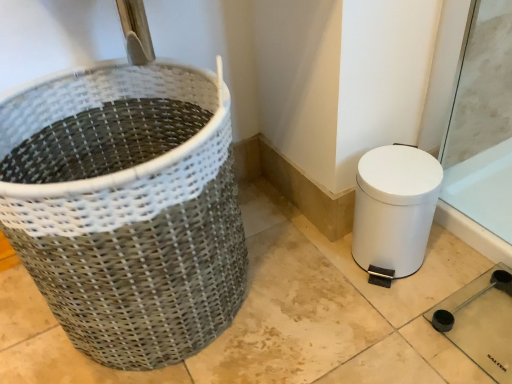
You are a GUI agent. You are given a task and a screenshot of the screen. Output one action in this format:
    pyautogui.click(x=<x>, y=<y>)
    Task: Click on the natural woven basket at left
    The width and height of the screenshot is (512, 384).
    Given the screenshot: What is the action you would take?
    pyautogui.click(x=126, y=208)

The width and height of the screenshot is (512, 384). Describe the element at coordinates (126, 208) in the screenshot. I see `natural woven basket at left` at that location.

Where is `white matte toilet bowl at lower right`? The width and height of the screenshot is (512, 384). white matte toilet bowl at lower right is located at coordinates (394, 207).

What do you see at coordinates (394, 207) in the screenshot?
I see `white matte toilet bowl at lower right` at bounding box center [394, 207].

Measure the distance between point (371, 180) and camera.

They are 34.29 inches apart.

At what (x,y) coordinates should I click in order to perform the action: click on natural woven basket at left. Please return your answer as a coordinate pair (x, y). This screenshot has height=384, width=512. Looking at the image, I should click on (126, 208).

In the image, is natural woven basket at left on the left side or the right side of white matte toilet bowl at lower right?

In the image, natural woven basket at left appears on the left side of white matte toilet bowl at lower right.

In the image, is natural woven basket at left positioned in front of or behind white matte toilet bowl at lower right?

natural woven basket at left is positioned closer to the viewer than white matte toilet bowl at lower right.

Does point (163, 67) lie behind point (438, 192)?

No, it is not.

From the image's perspective, is natural woven basket at left over white matte toilet bowl at lower right?

Indeed, from the image's perspective, natural woven basket at left is shown above white matte toilet bowl at lower right.

From a real-world perspective, which is physically below, natural woven basket at left or white matte toilet bowl at lower right?

From a 3D spatial view, white matte toilet bowl at lower right is below.

Does natural woven basket at left have a greater width compared to white matte toilet bowl at lower right?

Yes.

From the picture: Considering the sizes of natural woven basket at left and white matte toilet bowl at lower right in the image, is natural woven basket at left taller or shorter than white matte toilet bowl at lower right?

Considering their sizes, natural woven basket at left has more height than white matte toilet bowl at lower right.

Is natural woven basket at left bigger than white matte toilet bowl at lower right?

Yes.

Is natural woven basket at left completely or partially outside of white matte toilet bowl at lower right?

Yes, natural woven basket at left is located beyond the bounds of white matte toilet bowl at lower right.

Is natural woven basket at left in contact with white matte toilet bowl at lower right?

No, natural woven basket at left is not in contact with white matte toilet bowl at lower right.

Is natural woven basket at left oriented away from white matte toilet bowl at lower right?

No, natural woven basket at left's orientation is not away from white matte toilet bowl at lower right.

How much distance is there between natural woven basket at left and white matte toilet bowl at lower right?

They are 17.22 inches apart.

Locate an element on the screen. waste container lying in front of the white matte toilet bowl at lower right is located at coordinates (126, 208).

Can you confirm if white matte toilet bowl at lower right is positioned to the right of natural woven basket at left?

Indeed, white matte toilet bowl at lower right is positioned on the right side of natural woven basket at left.

Is the position of white matte toilet bowl at lower right less distant than that of natural woven basket at left?

That is False.

Considering the points (398, 251) and (177, 164), which point is in front, point (398, 251) or point (177, 164)?

The point (177, 164) is in front.

From the image's perspective, is white matte toilet bowl at lower right located above or below natural woven basket at left?

Clearly, from the image's perspective, white matte toilet bowl at lower right is below natural woven basket at left.

From a real-world perspective, which is physically above, white matte toilet bowl at lower right or natural woven basket at left?

natural woven basket at left, from a real-world perspective.

Considering the relative sizes of white matte toilet bowl at lower right and natural woven basket at left in the image provided, is white matte toilet bowl at lower right thinner than natural woven basket at left?

Yes.

Considering the sizes of objects white matte toilet bowl at lower right and natural woven basket at left in the image provided, who is shorter, white matte toilet bowl at lower right or natural woven basket at left?

With less height is white matte toilet bowl at lower right.

Based on their sizes in the image, would you say white matte toilet bowl at lower right is bigger or smaller than natural woven basket at left?

Clearly, white matte toilet bowl at lower right is smaller in size than natural woven basket at left.

Choose the correct answer: Is white matte toilet bowl at lower right inside natural woven basket at left or outside it?

white matte toilet bowl at lower right is located beyond the bounds of natural woven basket at left.

Are white matte toilet bowl at lower right and natural woven basket at left located far from each other?

No, there isn't a large distance between white matte toilet bowl at lower right and natural woven basket at left.

Is white matte toilet bowl at lower right positioned with its back to natural woven basket at left?

white matte toilet bowl at lower right is not turned away from natural woven basket at left.

How many degrees apart are the facing directions of white matte toilet bowl at lower right and natural woven basket at left?

They differ by 0.15 degrees in their facing directions.

Measure the distance between white matte toilet bowl at lower right and natural woven basket at left.

white matte toilet bowl at lower right is 17.22 inches from natural woven basket at left.

At what (x,y) coordinates should I click in order to perform the action: click on waste container above the white matte toilet bowl at lower right (from a real-world perspective). Please return your answer as a coordinate pair (x, y). This screenshot has width=512, height=384. Looking at the image, I should click on (126, 208).

You are a GUI agent. You are given a task and a screenshot of the screen. Output one action in this format:
    pyautogui.click(x=<x>, y=<y>)
    Task: Click on the waste container located in front of the white matte toilet bowl at lower right
    
    Given the screenshot: What is the action you would take?
    pyautogui.click(x=126, y=208)

Find the location of a particular element. waste container that is on the left side of white matte toilet bowl at lower right is located at coordinates (126, 208).